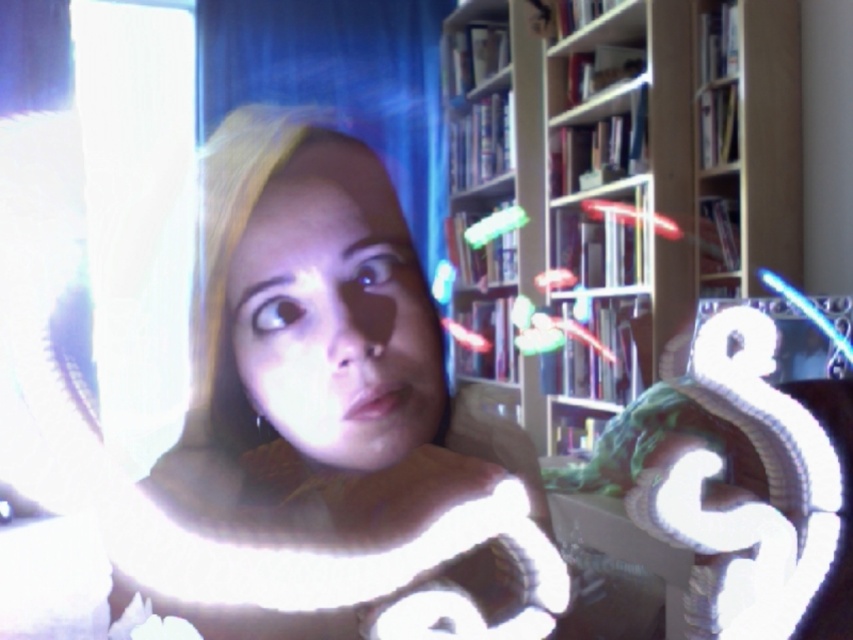
You are a photographer adjusting the focus on your camera. You notice two points in the image at coordinates point (492, 630) and point (306, 216). Which point is closer to the camera lens?

Point (306, 216) is closer to the camera lens because it is less further than point (492, 630), which is further away.

You are organizing a photo shoot in the scene described. You need to place a small decorative item between the matte white scarf at center and the wooden bookshelf at center. Considering their sizes, which object should the item be closer to?

The small decorative item should be placed closer to the wooden bookshelf at center because the matte white scarf at center occupies less space, meaning the bookshelf is larger and thus the item can be positioned nearer to it while maintaining balance.

You are an interior designer assessing the space shown in the image. The wooden bookshelf at center and the matte skin face at center are both in the room. Which object is taller?

The wooden bookshelf at center is taller than the matte skin face at center.